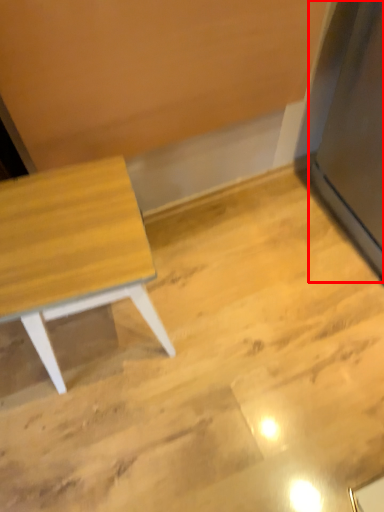
Question: Where is fridge (annotated by the red box) located in relation to table in the image?

Choices:
 (A) right
 (B) left

Answer: (A)